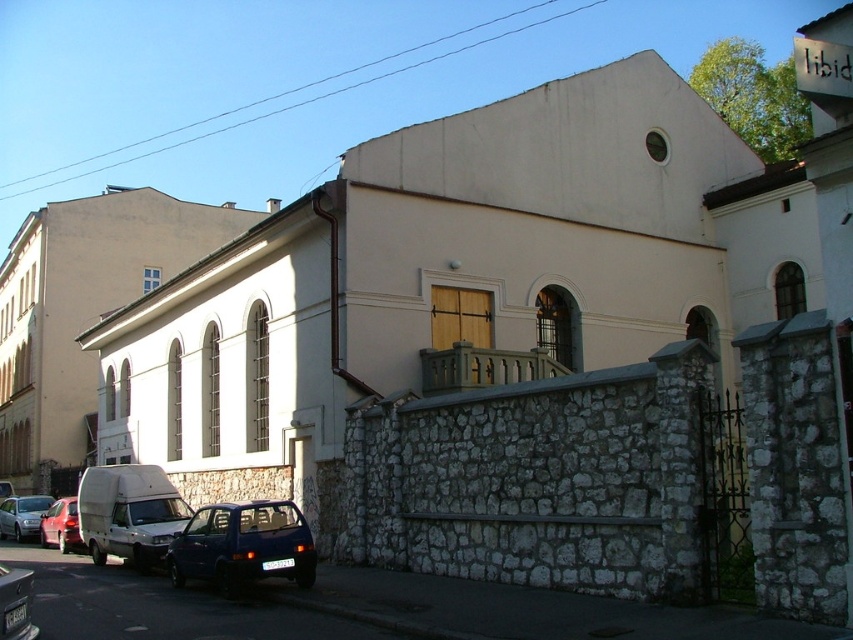
Is white matte van at lower left thinner than matte silver car at lower left?

Incorrect, white matte van at lower left's width is not less than matte silver car at lower left's.

Who is more distant from viewer, [151,561] or [18,541]?

Point [18,541]

Where is `white matte van at lower left`? white matte van at lower left is located at coordinates pyautogui.click(x=129, y=513).

From the picture: Who is higher up, white stone church at upper left or white matte van at lower left?

white stone church at upper left

Does point (62, 300) come in front of point (111, 552)?

No, (62, 300) is behind (111, 552).

Identify the location of white stone church at upper left. coord(83,310).

Who is positioned more to the right, metallic blue car at lower left or metallic red car at lower left?

metallic blue car at lower left is more to the right.

Which of these two, metallic blue car at lower left or metallic red car at lower left, stands taller?

With more height is metallic blue car at lower left.

Find the location of `metallic blue car at lower left`. metallic blue car at lower left is located at coordinates (15, 604).

The width and height of the screenshot is (853, 640). Identify the location of metallic blue car at lower left. (15, 604).